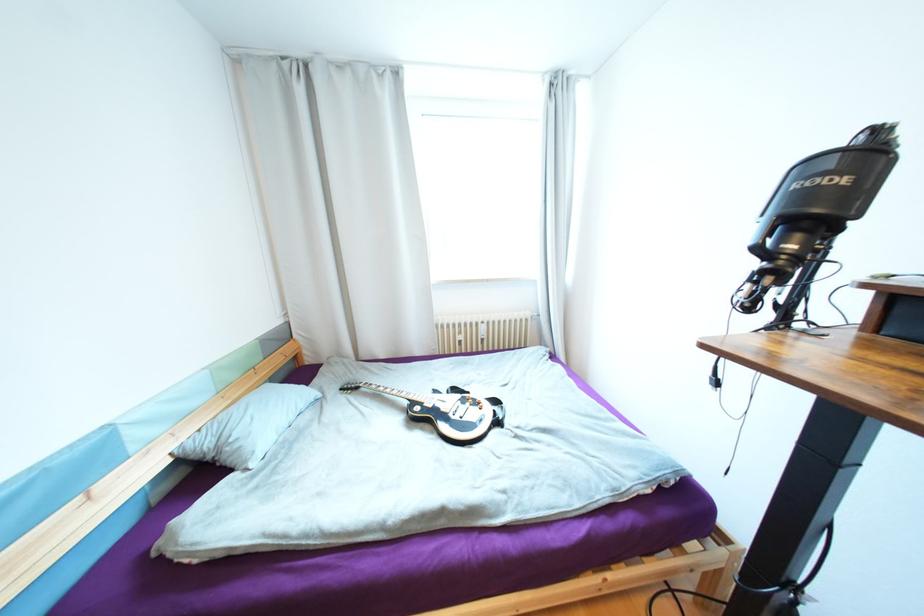
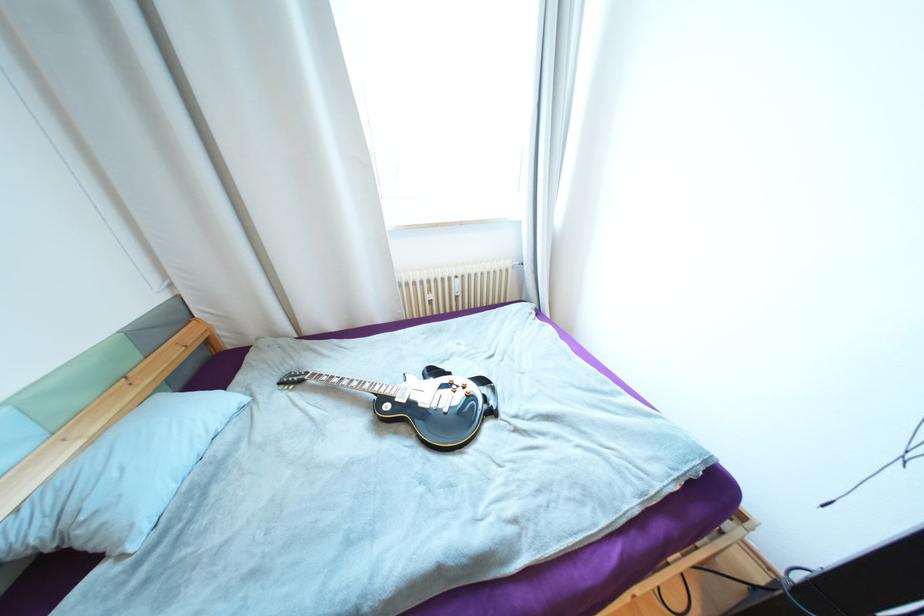
Locate, in the second image, the point that corresponds to (484,403) in the first image.

(469, 387)